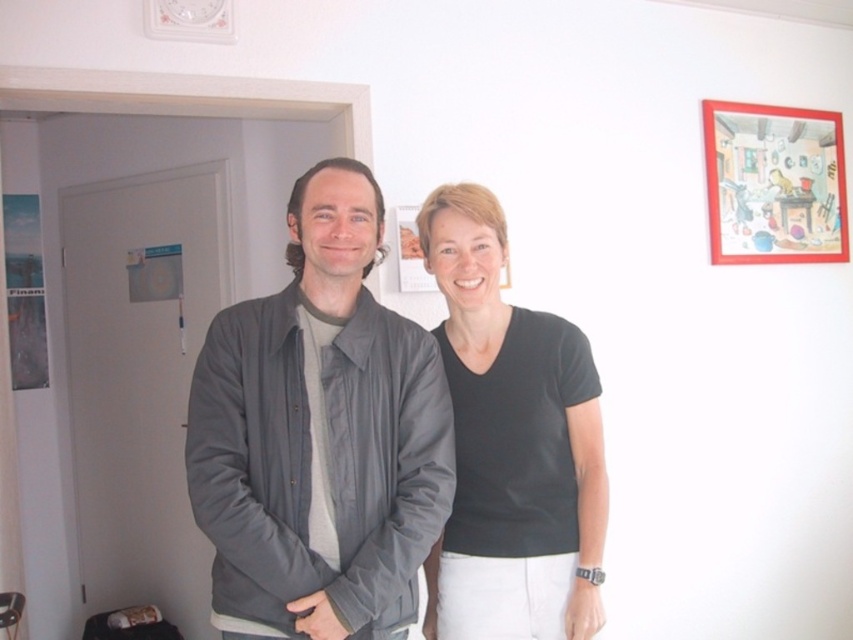
Does black matte shirt at center appear over matte red picture frame at upper right?

Actually, black matte shirt at center is below matte red picture frame at upper right.

Who is more distant from viewer, (561, 369) or (749, 157)?

The point (749, 157) is more distant.

Which is in front, point (434, 195) or point (752, 113)?

Point (434, 195) is in front.

Locate an element on the screen. Image resolution: width=853 pixels, height=640 pixels. black matte shirt at center is located at coordinates (511, 445).

Is gray fabric jacket at center in front of black matte shirt at center?

Yes, it is.

Can you confirm if gray fabric jacket at center is positioned to the right of black matte shirt at center?

Incorrect, gray fabric jacket at center is not on the right side of black matte shirt at center.

Who is more distant from viewer, (276, 332) or (474, 554)?

Positioned behind is point (474, 554).

You are a GUI agent. You are given a task and a screenshot of the screen. Output one action in this format:
    pyautogui.click(x=<x>, y=<y>)
    Task: Click on the gray fabric jacket at center
    The image size is (853, 640).
    Given the screenshot: What is the action you would take?
    pyautogui.click(x=320, y=435)

Can you confirm if gray fabric jacket at center is positioned above matte red picture frame at upper right?

No.

This screenshot has width=853, height=640. I want to click on gray fabric jacket at center, so click(320, 435).